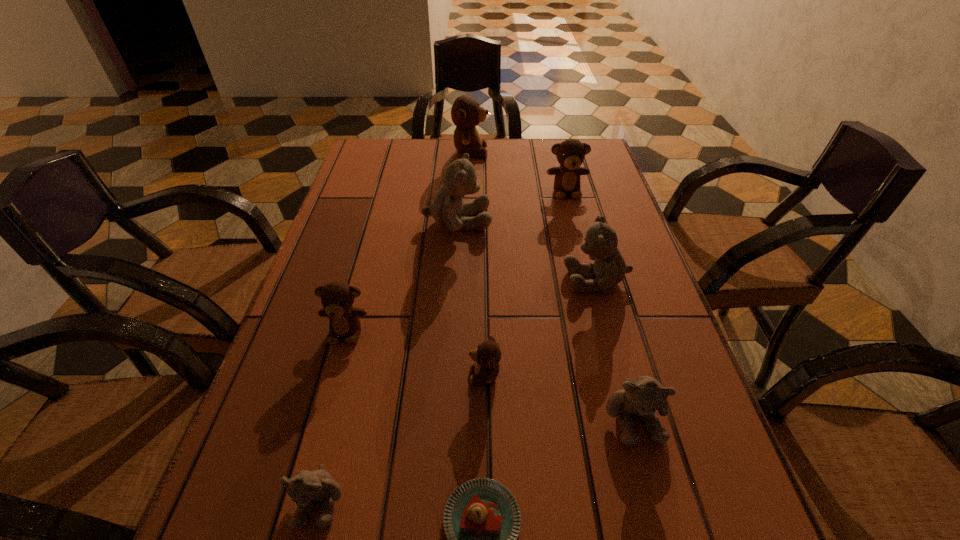
The height and width of the screenshot is (540, 960). In order to click on free space located on the face of the leftmost brown teddy bear in this screenshot , I will do `click(297, 509)`.

Image resolution: width=960 pixels, height=540 pixels. I want to click on vacant space located 0.060m on the face of the second nearest gray teddy bear, so click(x=654, y=490).

In order to click on vacant space located on the face of the smallest brown teddy bear in this screenshot , I will do `click(443, 375)`.

At what (x,y) coordinates should I click in order to perform the action: click on free region located on the face of the smallest brown teddy bear. Please return your answer as a coordinate pair (x, y). Looking at the image, I should click on (x=346, y=375).

Image resolution: width=960 pixels, height=540 pixels. I want to click on vacant position located on the face of the smallest brown teddy bear, so click(286, 375).

Identify the location of object at the far edge. This screenshot has width=960, height=540. (466, 113).

Identify the location of free spot at the far edge of the desktop. The height and width of the screenshot is (540, 960). (537, 154).

Image resolution: width=960 pixels, height=540 pixels. I want to click on vacant space at the left edge of the desktop, so click(339, 229).

Find the location of a particular element. free spot at the right edge of the desktop is located at coordinates [731, 470].

At what (x,y) coordinates should I click in order to perform the action: click on vacant space at the far right corner of the desktop. Please return your answer as a coordinate pair (x, y). Looking at the image, I should click on (594, 141).